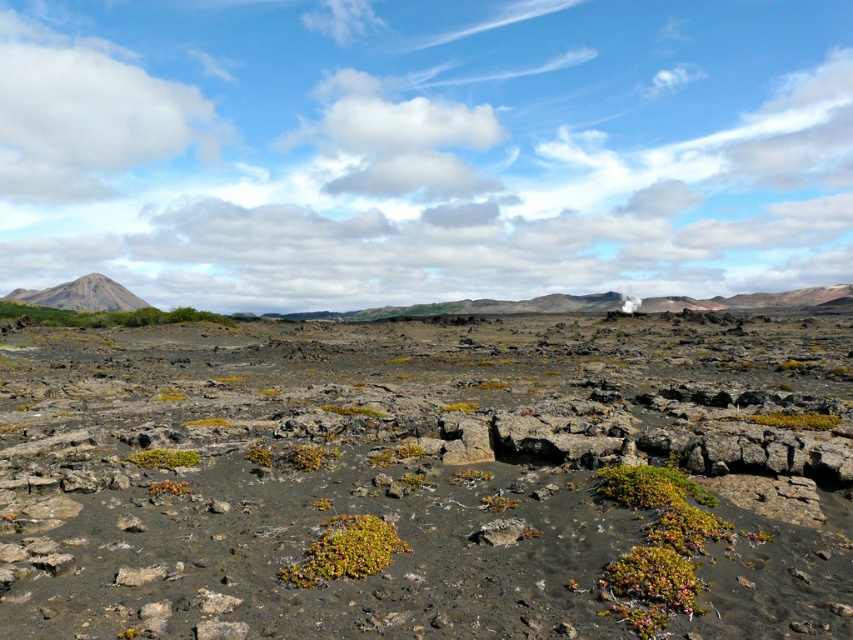
Question: Among these points, which one is farthest from the camera?

Choices:
 (A) (77, 307)
 (B) (383, 531)

Answer: (A)

Question: Does green mossy patch at center have a larger size compared to green mossy shrub at center?

Choices:
 (A) yes
 (B) no

Answer: (A)

Question: Is green mossy rock at center bigger than green mossy shrub at center?

Choices:
 (A) no
 (B) yes

Answer: (B)

Question: Which point is farther to the camera?

Choices:
 (A) dull gray rock at center
 (B) green mossy patch at center

Answer: (B)

Question: Which of the following is the closest to the observer?

Choices:
 (A) rustic brown rock formation at upper left
 (B) green mossy patch at center
 (C) green mossy rock at center
 (D) green mossy shrubs at left

Answer: (C)

Question: Considering the relative positions of green mossy patch at center and green mossy shrubs at left in the image provided, where is green mossy patch at center located with respect to green mossy shrubs at left?

Choices:
 (A) left
 (B) right

Answer: (B)